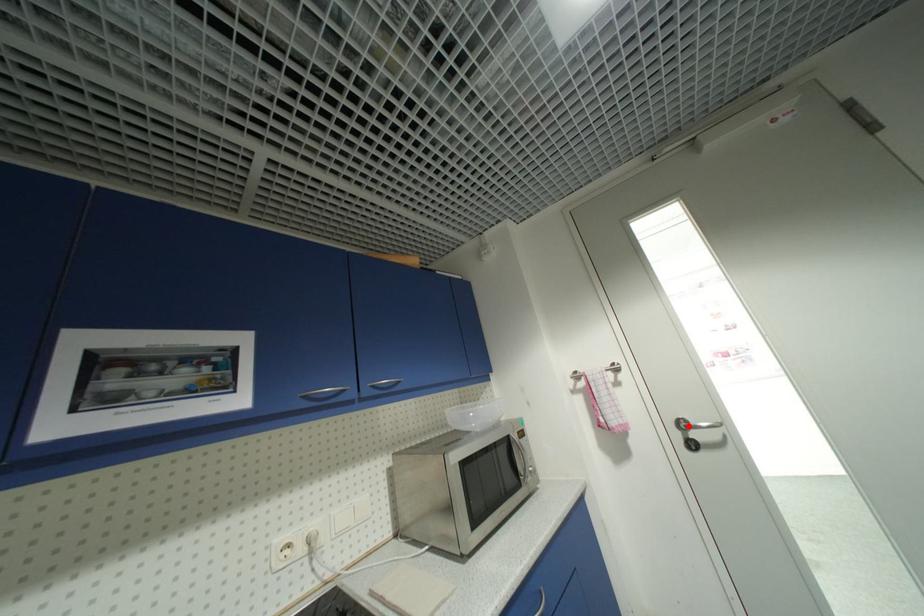
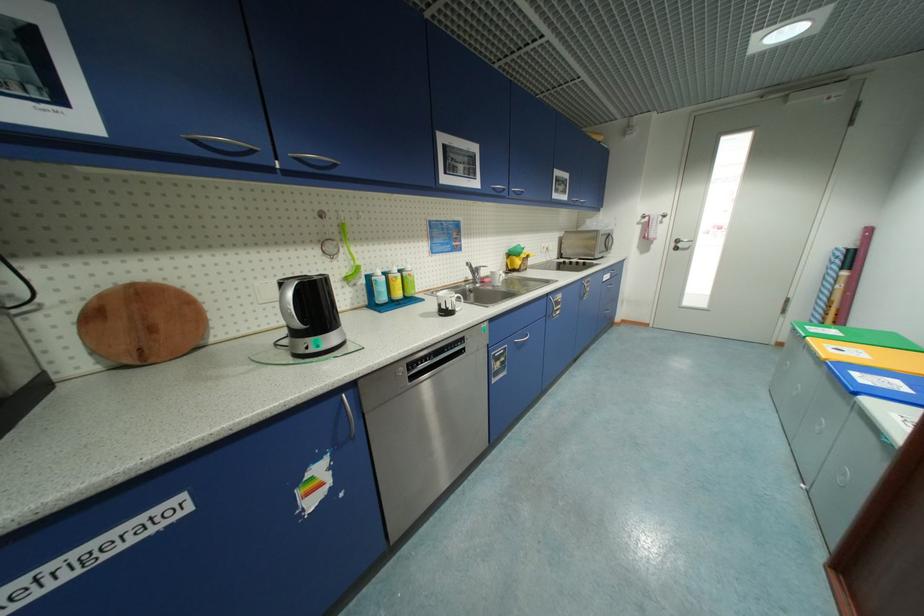
The point at the highlighted location is marked in the first image. Where is the corresponding point in the second image?

(684, 241)